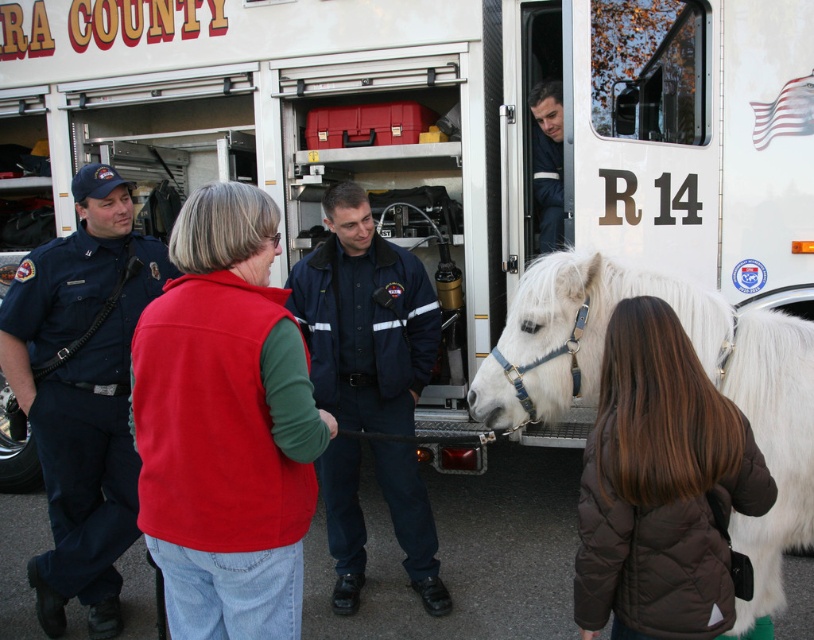
You are a photographer standing at the scene. You want to take a photo that includes both point (270,477) and point (82,449). Which point should you focus on first to ensure both are in sharp focus?

You should focus on point (270,477) first because it is closer to the camera than point (82,449). This ensures the closer point is in focus, and the farther point will also be within the depth of field.

You are an emergency responder trying to locate the badge on the dark blue uniform at left. Where would you look relative to the point at coordinates point (82, 392)?

The badge is located on the dark blue uniform at left, which is where the point (82, 392) is situated.

You are a drone operator trying to capture a photo of the two points in the scene. The first point is at coordinates point [86,403] and the second point is at point [546,220]. Which point will appear larger in your camera view?

Point [86,403] will appear larger in the camera view because it is closer to the camera than point [546,220].